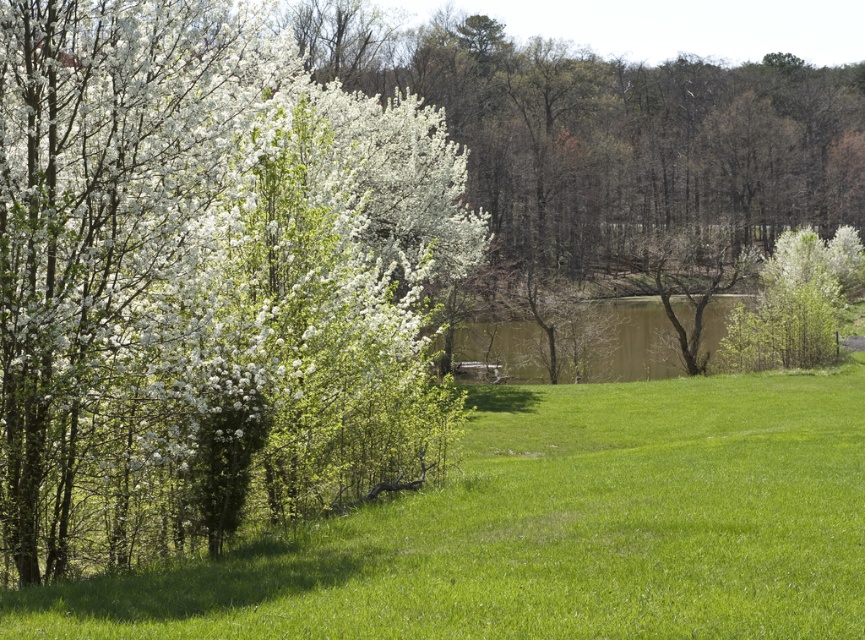
Which is above, white matte flowers at left or brown matte lake at center?

white matte flowers at left is higher up.

Does point (273, 188) lie in front of point (505, 340)?

Yes, point (273, 188) is in front of point (505, 340).

Identify the location of white matte flowers at left. (209, 275).

Can you confirm if green grassy at left is smaller than brown matte lake at center?

Correct, green grassy at left occupies less space than brown matte lake at center.

Between point (524, 550) and point (455, 365), which one is positioned behind?

The point (455, 365) is more distant.

Which is in front, point (43, 588) or point (633, 328)?

Point (43, 588) is in front.

In order to click on green grassy at left in this screenshot , I will do `click(552, 529)`.

Is white matte flowers at left thinner than green grassy at left?

Indeed, white matte flowers at left has a lesser width compared to green grassy at left.

The height and width of the screenshot is (640, 865). What do you see at coordinates (209, 275) in the screenshot? I see `white matte flowers at left` at bounding box center [209, 275].

Does point (283, 317) come farther from viewer compared to point (173, 636)?

Yes, point (283, 317) is farther from viewer.

Locate an element on the screen. This screenshot has width=865, height=640. white matte flowers at left is located at coordinates (209, 275).